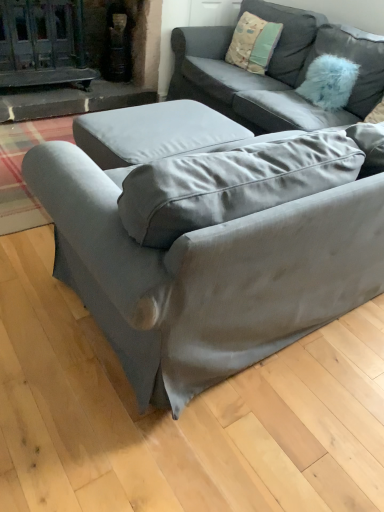
This screenshot has width=384, height=512. Describe the element at coordinates (207, 274) in the screenshot. I see `satin gray couch at center, the 1th studio couch in the front-to-back sequence` at that location.

What do you see at coordinates (275, 70) in the screenshot? This screenshot has width=384, height=512. I see `satin gray couch at center, the second studio couch in the front-to-back sequence` at bounding box center [275, 70].

What is the approximate width of textured cotton pillow at upper right, acting as the 1th pillow starting from the left?

The width of textured cotton pillow at upper right, acting as the 1th pillow starting from the left, is 8.61 inches.

The width and height of the screenshot is (384, 512). Find the location of `satin gray couch at center, acting as the 2th studio couch starting from the back`. satin gray couch at center, acting as the 2th studio couch starting from the back is located at coordinates (207, 274).

Consider the image. Looking at their sizes, would you say fuzzy blue pillow at upper right, which is counted as the first pillow, starting from the right, is wider or thinner than satin gray couch at center, the 1th studio couch in the front-to-back sequence?

Clearly, fuzzy blue pillow at upper right, which is counted as the first pillow, starting from the right, has less width compared to satin gray couch at center, the 1th studio couch in the front-to-back sequence.

How far apart are fuzzy blue pillow at upper right, placed as the 2th pillow when sorted from left to right, and satin gray couch at center, acting as the 2th studio couch starting from the back?

fuzzy blue pillow at upper right, placed as the 2th pillow when sorted from left to right, is 1.80 meters from satin gray couch at center, acting as the 2th studio couch starting from the back.

From the image's perspective, which one is positioned lower, fuzzy blue pillow at upper right, placed as the 2th pillow when sorted from left to right, or satin gray couch at center, acting as the 2th studio couch starting from the back?

satin gray couch at center, acting as the 2th studio couch starting from the back, appears lower in the image.

From a real-world perspective, is fuzzy blue pillow at upper right, which is counted as the first pillow, starting from the right, under satin gray couch at center, acting as the 2th studio couch starting from the back?

No, from a real-world perspective, fuzzy blue pillow at upper right, which is counted as the first pillow, starting from the right, is not below satin gray couch at center, acting as the 2th studio couch starting from the back.

Considering the positions of point (217, 274) and point (266, 41), is point (217, 274) closer or farther from the camera than point (266, 41)?

Point (217, 274) is positioned closer to the camera compared to point (266, 41).

From a real-world perspective, is satin gray couch at center, the 1th studio couch in the front-to-back sequence, below textured cotton pillow at upper right, acting as the second pillow starting from the right?

Indeed, from a real-world perspective, satin gray couch at center, the 1th studio couch in the front-to-back sequence, is positioned beneath textured cotton pillow at upper right, acting as the second pillow starting from the right.

From the textured cotton pillow at upper right, acting as the 1th pillow starting from the left, count 2nd studio couchs forward and point to it. Please provide its 2D coordinates.

[(207, 274)]

From the image's perspective, would you say satin gray couch at center, the 1th studio couch in the front-to-back sequence, is positioned over textured cotton pillow at upper right, acting as the 1th pillow starting from the left?

No, from the image's perspective, satin gray couch at center, the 1th studio couch in the front-to-back sequence, is not on top of textured cotton pillow at upper right, acting as the 1th pillow starting from the left.

Based on their sizes in the image, would you say satin gray couch at center, the 1th studio couch in the front-to-back sequence, is bigger or smaller than fuzzy blue pillow at upper right, which is counted as the first pillow, starting from the right?

satin gray couch at center, the 1th studio couch in the front-to-back sequence, is bigger than fuzzy blue pillow at upper right, which is counted as the first pillow, starting from the right.

From the image's perspective, is satin gray couch at center, acting as the 2th studio couch starting from the back, located above fuzzy blue pillow at upper right, placed as the 2th pillow when sorted from left to right?

No, from the image's perspective, satin gray couch at center, acting as the 2th studio couch starting from the back, is not over fuzzy blue pillow at upper right, placed as the 2th pillow when sorted from left to right.

Is satin gray couch at center, the 1th studio couch in the front-to-back sequence, far from fuzzy blue pillow at upper right, placed as the 2th pillow when sorted from left to right?

That's right, there is a large distance between satin gray couch at center, the 1th studio couch in the front-to-back sequence, and fuzzy blue pillow at upper right, placed as the 2th pillow when sorted from left to right.

Would you say fuzzy blue pillow at upper right, placed as the 2th pillow when sorted from left to right, is inside or outside satin gray couch at center, acting as the first studio couch starting from the back?

fuzzy blue pillow at upper right, placed as the 2th pillow when sorted from left to right, is inside satin gray couch at center, acting as the first studio couch starting from the back.

Is fuzzy blue pillow at upper right, placed as the 2th pillow when sorted from left to right, in front of or behind satin gray couch at center, the second studio couch in the front-to-back sequence, in the image?

Clearly, fuzzy blue pillow at upper right, placed as the 2th pillow when sorted from left to right, is behind satin gray couch at center, the second studio couch in the front-to-back sequence.

Is fuzzy blue pillow at upper right, which is counted as the first pillow, starting from the right, positioned far away from satin gray couch at center, the second studio couch in the front-to-back sequence?

fuzzy blue pillow at upper right, which is counted as the first pillow, starting from the right, is actually quite close to satin gray couch at center, the second studio couch in the front-to-back sequence.

Is fuzzy blue pillow at upper right, placed as the 2th pillow when sorted from left to right, smaller than satin gray couch at center, acting as the first studio couch starting from the back?

Correct, fuzzy blue pillow at upper right, placed as the 2th pillow when sorted from left to right, occupies less space than satin gray couch at center, acting as the first studio couch starting from the back.

Visually, is satin gray couch at center, acting as the first studio couch starting from the back, positioned to the left or to the right of satin gray couch at center, acting as the 2th studio couch starting from the back?

satin gray couch at center, acting as the first studio couch starting from the back, is to the right of satin gray couch at center, acting as the 2th studio couch starting from the back.

Would you say satin gray couch at center, the second studio couch in the front-to-back sequence, is inside or outside satin gray couch at center, the 1th studio couch in the front-to-back sequence?

satin gray couch at center, the second studio couch in the front-to-back sequence, is spatially situated outside satin gray couch at center, the 1th studio couch in the front-to-back sequence.

Is satin gray couch at center, acting as the first studio couch starting from the back, facing towards satin gray couch at center, the 1th studio couch in the front-to-back sequence?

Yes.

From their relative heights in the image, would you say satin gray couch at center, the second studio couch in the front-to-back sequence, is taller or shorter than satin gray couch at center, the 1th studio couch in the front-to-back sequence?

satin gray couch at center, the second studio couch in the front-to-back sequence, is taller than satin gray couch at center, the 1th studio couch in the front-to-back sequence.

Is satin gray couch at center, the second studio couch in the front-to-back sequence, facing away from textured cotton pillow at upper right, acting as the second pillow starting from the right?

Yes, satin gray couch at center, the second studio couch in the front-to-back sequence, is positioned with its back facing textured cotton pillow at upper right, acting as the second pillow starting from the right.

From the satin gray couch at center, the second studio couch in the front-to-back sequence, count 2nd pillows backward and point to it. Please provide its 2D coordinates.

[(253, 42)]

Which is in front, satin gray couch at center, acting as the first studio couch starting from the back, or textured cotton pillow at upper right, acting as the 1th pillow starting from the left?

satin gray couch at center, acting as the first studio couch starting from the back, is more forward.

Is satin gray couch at center, the second studio couch in the front-to-back sequence, facing towards fuzzy blue pillow at upper right, placed as the 2th pillow when sorted from left to right?

Yes.

Which object is more forward, satin gray couch at center, acting as the first studio couch starting from the back, or fuzzy blue pillow at upper right, which is counted as the first pillow, starting from the right?

Positioned in front is satin gray couch at center, acting as the first studio couch starting from the back.

From a real-world perspective, is satin gray couch at center, acting as the first studio couch starting from the back, physically below fuzzy blue pillow at upper right, placed as the 2th pillow when sorted from left to right?

Correct, in the physical world, satin gray couch at center, acting as the first studio couch starting from the back, is lower than fuzzy blue pillow at upper right, placed as the 2th pillow when sorted from left to right.

How many degrees apart are the facing directions of satin gray couch at center, acting as the first studio couch starting from the back, and fuzzy blue pillow at upper right, placed as the 2th pillow when sorted from left to right?

3.73 degrees.

From the image's perspective, starting from the satin gray couch at center, the 1th studio couch in the front-to-back sequence, which pillow is the 1st one above? Please provide its 2D coordinates.

[(354, 62)]

In order to click on pillow that is the 1st object to the right of the satin gray couch at center, the 1th studio couch in the front-to-back sequence, starting at the anchor in this screenshot , I will do `click(253, 42)`.

From the image, which object appears to be farther from satin gray couch at center, acting as the first studio couch starting from the back, satin gray couch at center, the 1th studio couch in the front-to-back sequence, or textured cotton pillow at upper right, acting as the 1th pillow starting from the left?

The object further to satin gray couch at center, acting as the first studio couch starting from the back, is satin gray couch at center, the 1th studio couch in the front-to-back sequence.

When comparing their distances from textured cotton pillow at upper right, acting as the second pillow starting from the right, does satin gray couch at center, the second studio couch in the front-to-back sequence, or satin gray couch at center, the 1th studio couch in the front-to-back sequence, seem closer?

The object closer to textured cotton pillow at upper right, acting as the second pillow starting from the right, is satin gray couch at center, the second studio couch in the front-to-back sequence.

Based on their spatial positions, is textured cotton pillow at upper right, acting as the 1th pillow starting from the left, or fuzzy blue pillow at upper right, placed as the 2th pillow when sorted from left to right, further from satin gray couch at center, the 1th studio couch in the front-to-back sequence?

Among the two, textured cotton pillow at upper right, acting as the 1th pillow starting from the left, is located further to satin gray couch at center, the 1th studio couch in the front-to-back sequence.

From the image, which object appears to be nearer to fuzzy blue pillow at upper right, which is counted as the first pillow, starting from the right, satin gray couch at center, the second studio couch in the front-to-back sequence, or satin gray couch at center, the 1th studio couch in the front-to-back sequence?

satin gray couch at center, the second studio couch in the front-to-back sequence, lies closer to fuzzy blue pillow at upper right, which is counted as the first pillow, starting from the right, than the other object.

Which object lies further to the anchor point textured cotton pillow at upper right, acting as the 1th pillow starting from the left, fuzzy blue pillow at upper right, which is counted as the first pillow, starting from the right, or satin gray couch at center, acting as the 2th studio couch starting from the back?

satin gray couch at center, acting as the 2th studio couch starting from the back, is further to textured cotton pillow at upper right, acting as the 1th pillow starting from the left.

Estimate the real-world distances between objects in this image. Which object is closer to satin gray couch at center, the second studio couch in the front-to-back sequence, textured cotton pillow at upper right, acting as the 1th pillow starting from the left, or fuzzy blue pillow at upper right, which is counted as the first pillow, starting from the right?

The object closer to satin gray couch at center, the second studio couch in the front-to-back sequence, is fuzzy blue pillow at upper right, which is counted as the first pillow, starting from the right.

From the picture: Which object lies nearer to the anchor point satin gray couch at center, acting as the 2th studio couch starting from the back, fuzzy blue pillow at upper right, placed as the 2th pillow when sorted from left to right, or textured cotton pillow at upper right, acting as the 1th pillow starting from the left?

fuzzy blue pillow at upper right, placed as the 2th pillow when sorted from left to right.

When comparing their distances from satin gray couch at center, acting as the first studio couch starting from the back, does fuzzy blue pillow at upper right, which is counted as the first pillow, starting from the right, or satin gray couch at center, acting as the 2th studio couch starting from the back, seem further?

satin gray couch at center, acting as the 2th studio couch starting from the back, is positioned further to the anchor satin gray couch at center, acting as the first studio couch starting from the back.

This screenshot has height=512, width=384. I want to click on pillow between satin gray couch at center, the 1th studio couch in the front-to-back sequence, and textured cotton pillow at upper right, acting as the 1th pillow starting from the left, along the z-axis, so click(x=354, y=62).

Find the location of a particular element. studio couch between satin gray couch at center, acting as the 2th studio couch starting from the back, and fuzzy blue pillow at upper right, which is counted as the first pillow, starting from the right, from front to back is located at coordinates (275, 70).

Identify the location of studio couch between satin gray couch at center, acting as the 2th studio couch starting from the back, and textured cotton pillow at upper right, acting as the second pillow starting from the right, along the z-axis. The height and width of the screenshot is (512, 384). (275, 70).

Identify the location of pillow between satin gray couch at center, the second studio couch in the front-to-back sequence, and textured cotton pillow at upper right, acting as the second pillow starting from the right, in the front-back direction. (354, 62).